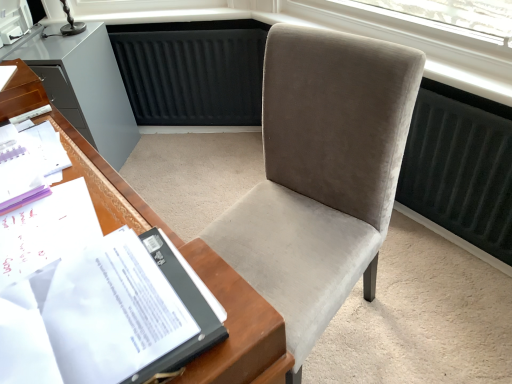
This screenshot has width=512, height=384. In order to click on velvet gray chair at center in this screenshot , I will do `click(321, 175)`.

Find the location of a particular element. white paper at left is located at coordinates (29, 164).

At what (x,y) coordinates should I click in order to perform the action: click on velvet gray chair at center. Please return your answer as a coordinate pair (x, y). This screenshot has height=384, width=512. Looking at the image, I should click on (321, 175).

I want to click on chair below the white paper at left (from a real-world perspective), so click(321, 175).

Is velvet gray chair at center surrounding white paper at left?

No, velvet gray chair at center does not contain white paper at left.

From their relative heights in the image, would you say velvet gray chair at center is taller or shorter than white paper at left?

Considering their sizes, velvet gray chair at center has more height than white paper at left.

From the image's perspective, which one is positioned higher, velvet gray chair at center or white paper at left?

white paper at left.

Considering the sizes of white paper at left and white paper at left in the image, is white paper at left taller or shorter than white paper at left?

white paper at left is shorter than white paper at left.

Which object is positioned more to the right, white paper at left or white paper at left?

From the viewer's perspective, white paper at left appears more on the right side.

Considering the positions of objects white paper at left and white paper at left in the image provided, who is behind, white paper at left or white paper at left?

white paper at left is further from the camera.

You are a GUI agent. You are given a task and a screenshot of the screen. Output one action in this format:
    pyautogui.click(x=<x>, y=<y>)
    Task: Click on the journal on the right of white paper at left
    The height and width of the screenshot is (384, 512).
    Given the screenshot: What is the action you would take?
    pyautogui.click(x=113, y=311)

Is white paper at left oriented towards velvet gray chair at center?

Yes, white paper at left is facing velvet gray chair at center.

From a real-world perspective, is white paper at left under velvet gray chair at center?

Actually, white paper at left is physically above velvet gray chair at center in the real world.

Is white paper at left closer to the viewer compared to velvet gray chair at center?

No, white paper at left is further to the viewer.

Are white paper at left and velvet gray chair at center located far from each other?

That's not correct — white paper at left is a little close to velvet gray chair at center.

Does velvet gray chair at center appear on the right side of white paper at left?

Correct, you'll find velvet gray chair at center to the right of white paper at left.

Based on the photo, does velvet gray chair at center lie behind white paper at left?

Yes.

From a real-world perspective, is velvet gray chair at center on white paper at left?

Incorrect, from a real-world perspective, velvet gray chair at center is lower than white paper at left.

The height and width of the screenshot is (384, 512). In order to click on journal on the left of velvet gray chair at center in this screenshot , I will do [113, 311].

Can you confirm if matte gray cabinet at left is positioned to the right of white paper at left?

Incorrect, matte gray cabinet at left is not on the right side of white paper at left.

From a real-world perspective, is matte gray cabinet at left positioned above or below white paper at left?

From a real-world perspective, matte gray cabinet at left is physically below white paper at left.

Would you say matte gray cabinet at left is inside or outside white paper at left?

matte gray cabinet at left cannot be found inside white paper at left.

Are matte gray cabinet at left and white paper at left located far from each other?

Yes, matte gray cabinet at left and white paper at left are located far from each other.

Considering the relative sizes of matte gray cabinet at left and white paper at left in the image provided, is matte gray cabinet at left bigger than white paper at left?

Correct, matte gray cabinet at left is larger in size than white paper at left.

Is matte gray cabinet at left facing away from white paper at left?

That's not correct — matte gray cabinet at left is not looking away from white paper at left.

Considering the relative sizes of matte gray cabinet at left and white paper at left in the image provided, is matte gray cabinet at left taller than white paper at left?

Correct, matte gray cabinet at left is much taller as white paper at left.

In the scene shown: Does matte gray cabinet at left touch white paper at left?

matte gray cabinet at left and white paper at left are clearly separated.

From the image's perspective, is matte gray cabinet at left located above or below velvet gray chair at center?

matte gray cabinet at left is above velvet gray chair at center.

Is matte gray cabinet at left to the left or to the right of velvet gray chair at center in the image?

matte gray cabinet at left is to the left of velvet gray chair at center.

Does matte gray cabinet at left touch velvet gray chair at center?

No, matte gray cabinet at left is not beside velvet gray chair at center.

From a real-world perspective, who is located lower, matte gray cabinet at left or velvet gray chair at center?

matte gray cabinet at left, from a real-world perspective.

You are a GUI agent. You are given a task and a screenshot of the screen. Output one action in this format:
    pyautogui.click(x=<x>, y=<y>)
    Task: Click on the book above the velvet gray chair at center (from the image's perspective)
    This screenshot has height=384, width=512.
    Given the screenshot: What is the action you would take?
    [x=29, y=164]

Identify the location of journal on the right of white paper at left. This screenshot has width=512, height=384. (113, 311).

Which object lies further to the anchor point velvet gray chair at center, matte gray cabinet at left or white paper at left?

matte gray cabinet at left is further to velvet gray chair at center.

Looking at this image, which object lies further to the anchor point white paper at left, matte gray cabinet at left or white paper at left?

matte gray cabinet at left is further to white paper at left.

Based on their spatial positions, is white paper at left or velvet gray chair at center closer to matte gray cabinet at left?

Among the two, white paper at left is located nearer to matte gray cabinet at left.

When comparing their distances from velvet gray chair at center, does white paper at left or matte gray cabinet at left seem closer?

The object closer to velvet gray chair at center is white paper at left.

Looking at the image, which one is located further to matte gray cabinet at left, white paper at left or velvet gray chair at center?

white paper at left lies further to matte gray cabinet at left than the other object.

Considering their positions, is white paper at left positioned further to matte gray cabinet at left than white paper at left?

Among the two, white paper at left is located further to matte gray cabinet at left.

From the image, which object appears to be nearer to white paper at left, matte gray cabinet at left or white paper at left?

white paper at left is closer to white paper at left.

Looking at the image, which one is located closer to velvet gray chair at center, white paper at left or matte gray cabinet at left?

white paper at left lies closer to velvet gray chair at center than the other object.

Find the location of a particular element. book between white paper at left and matte gray cabinet at left in the front-back direction is located at coordinates (29, 164).

Where is `book between velvet gray chair at center and matte gray cabinet at left along the z-axis`? The width and height of the screenshot is (512, 384). book between velvet gray chair at center and matte gray cabinet at left along the z-axis is located at coordinates (29, 164).

Identify the location of chair between white paper at left and matte gray cabinet at left from front to back. (321, 175).

I want to click on journal situated between white paper at left and velvet gray chair at center from left to right, so click(x=113, y=311).